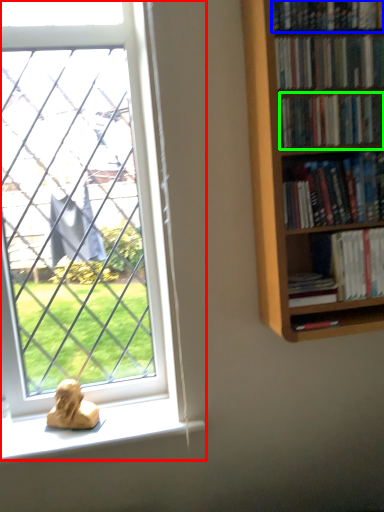
Question: Which is nearer to the window (highlighted by a red box)? book (highlighted by a blue box) or book (highlighted by a green box).

Choices:
 (A) book
 (B) book

Answer: (B)